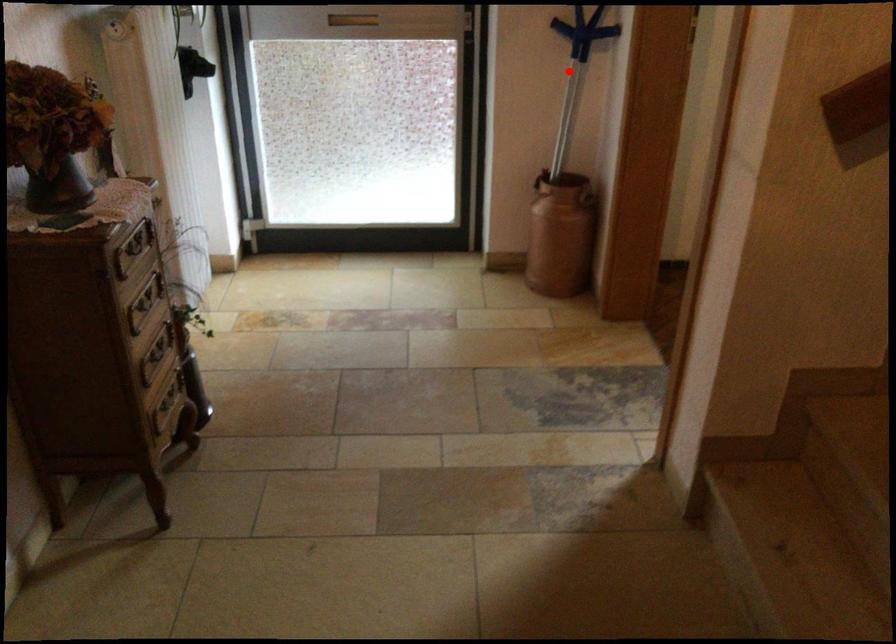
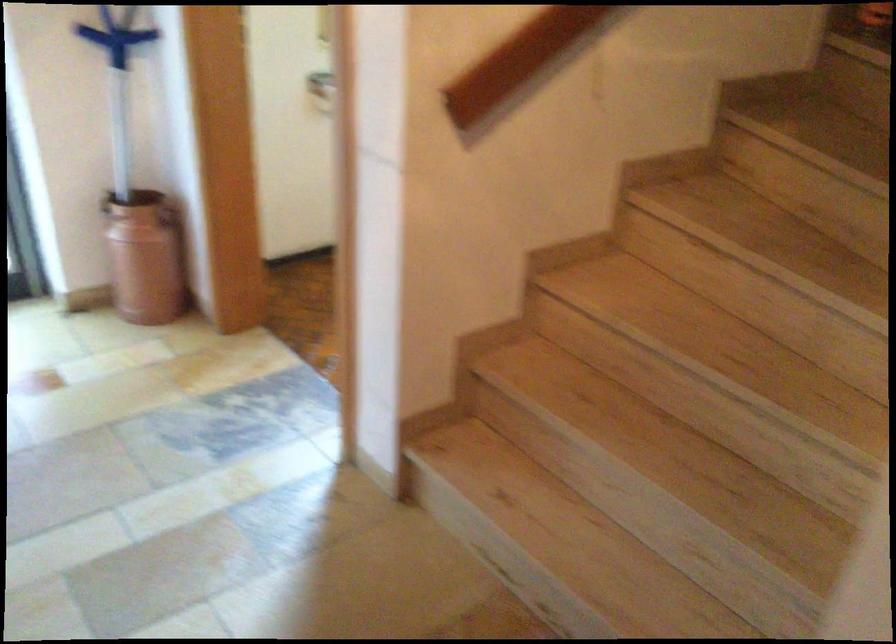
Find the pixel in the second image that matches the highlighted location in the first image.

(117, 82)